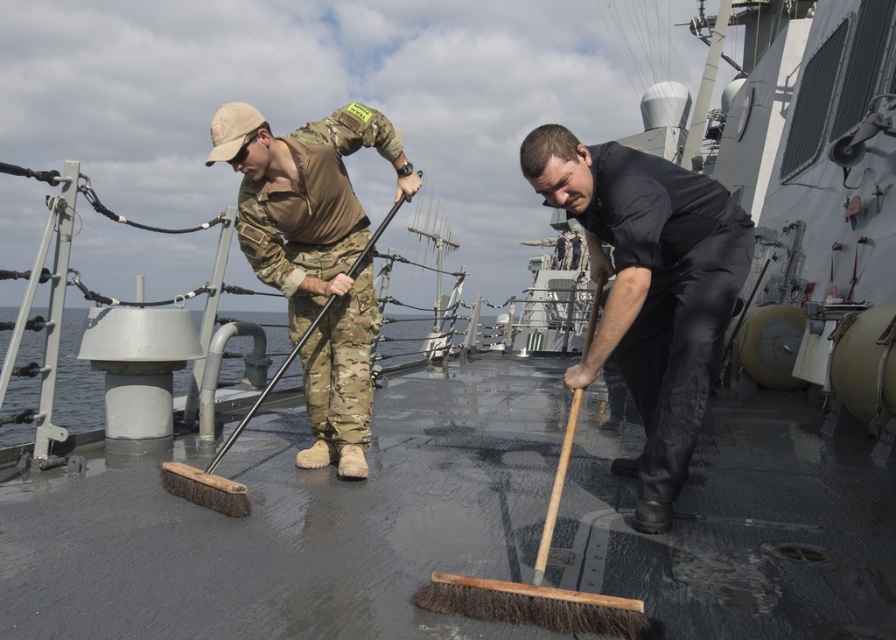
Who is more forward, (x=570, y=180) or (x=371, y=129)?

Point (x=570, y=180) is in front.

Is black matte broom at center thinner than camouflage fabric uniform at center?

Yes, black matte broom at center is thinner than camouflage fabric uniform at center.

Is point (743, 227) in front of point (347, 202)?

Yes, point (743, 227) is in front of point (347, 202).

Locate an element on the screen. The width and height of the screenshot is (896, 640). black matte broom at center is located at coordinates (649, 289).